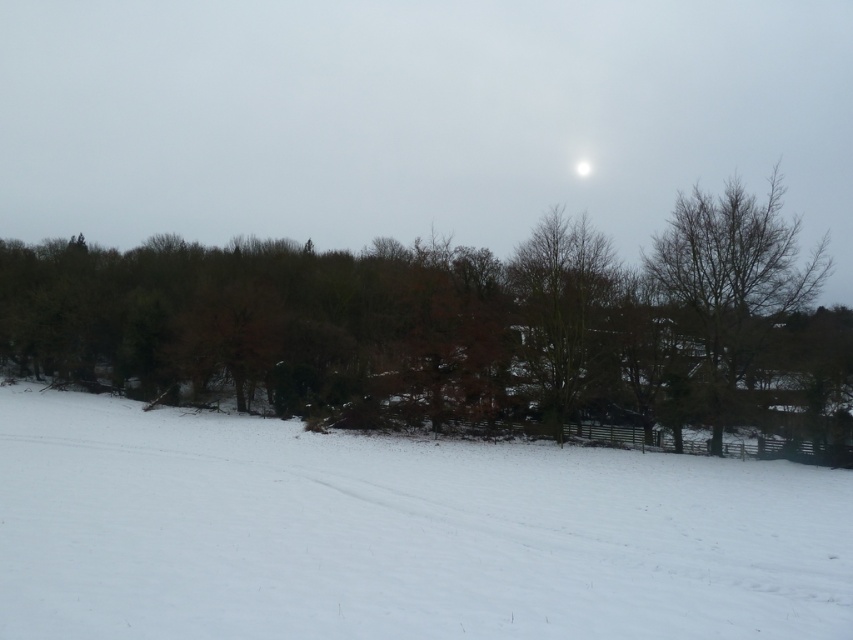
Question: Which object is the farthest from the bare branches at right?

Choices:
 (A) brown leafy tree at center
 (B) bare branches at center

Answer: (A)

Question: Which object is closer to the camera taking this photo?

Choices:
 (A) bare branches at right
 (B) bare branches at center

Answer: (A)

Question: Among these points, which one is nearest to the camera?

Choices:
 (A) (621, 380)
 (B) (426, 552)
 (C) (744, 240)

Answer: (B)

Question: Can you confirm if white snow ski slope at lower center is thinner than brown leafy tree at center?

Choices:
 (A) no
 (B) yes

Answer: (B)

Question: Does white snow ski slope at lower center appear on the left side of bare branches at right?

Choices:
 (A) yes
 (B) no

Answer: (A)

Question: Can you confirm if white snow ski slope at lower center is smaller than brown leafy tree at center?

Choices:
 (A) yes
 (B) no

Answer: (A)